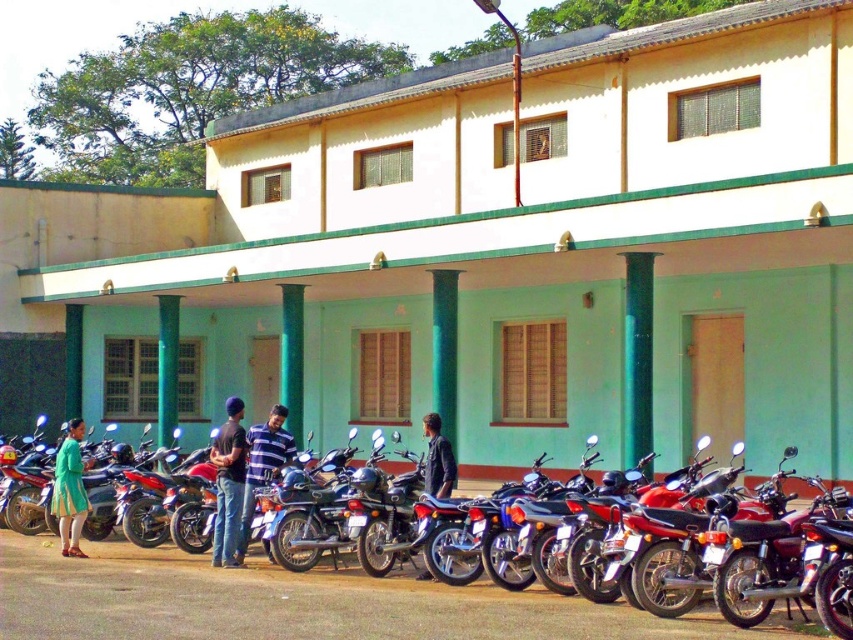
Is the position of dark blue shirt at center less distant than that of dark blue leather jacket at center?

No, dark blue shirt at center is behind dark blue leather jacket at center.

Between dark blue shirt at center and dark blue leather jacket at center, which one has more height?

dark blue shirt at center is taller.

Which is behind, point (239, 493) or point (430, 474)?

The point (239, 493) is behind.

Find the location of a particular element. The width and height of the screenshot is (853, 640). dark blue shirt at center is located at coordinates (228, 483).

Can you confirm if matte green dress at lower left is positioned above dark blue fabric shirt at center?

No, matte green dress at lower left is not above dark blue fabric shirt at center.

Who is shorter, matte green dress at lower left or dark blue fabric shirt at center?

With less height is dark blue fabric shirt at center.

Between point (74, 554) and point (427, 422), which one is positioned in front?

Positioned in front is point (427, 422).

The height and width of the screenshot is (640, 853). What are the coordinates of `matte green dress at lower left` in the screenshot? It's located at (70, 490).

Which is below, striped fabric shirt at center or dark blue leather jacket at center?

Positioned lower is striped fabric shirt at center.

Which is above, striped fabric shirt at center or dark blue leather jacket at center?

dark blue leather jacket at center

Image resolution: width=853 pixels, height=640 pixels. I want to click on striped fabric shirt at center, so click(x=262, y=465).